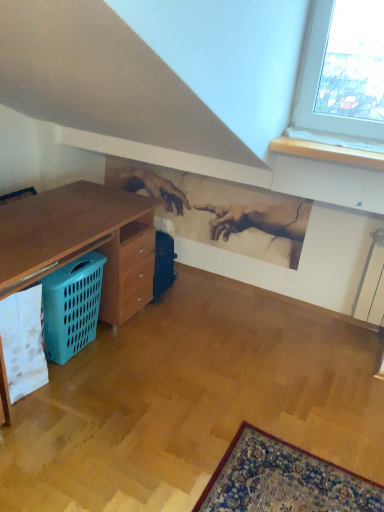
Describe the element at coordinates (71, 306) in the screenshot. The width and height of the screenshot is (384, 512). I see `blue plastic laundry basket at lower left` at that location.

Locate an element on the screen. blue plastic laundry basket at lower left is located at coordinates [71, 306].

What is the approximate width of blue plastic laundry basket at lower left?

It is 7.39 inches.

In order to face blue plastic laundry basket at lower left, should I rotate leftwards or rightwards?

→ You should look left and rotate roughly 15.098 degrees.

Locate an element on the screen. The height and width of the screenshot is (512, 384). blue plastic laundry basket at lower left is located at coordinates (71, 306).